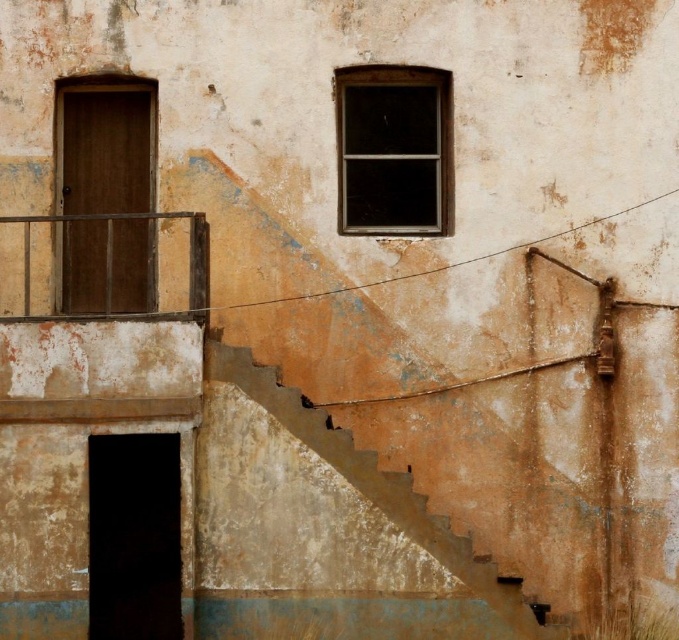
Question: Does rusty concrete stairs at lower right lie behind rusty metal balustrade at left?

Choices:
 (A) yes
 (B) no

Answer: (A)

Question: Does rusty concrete stairs at lower right come in front of rusty metal balustrade at left?

Choices:
 (A) no
 (B) yes

Answer: (A)

Question: Which of the following is the closest to the observer?

Choices:
 (A) (227, 349)
 (B) (139, 316)

Answer: (B)

Question: Does rusty concrete stairs at lower right have a larger size compared to rusty metal balustrade at left?

Choices:
 (A) yes
 (B) no

Answer: (A)